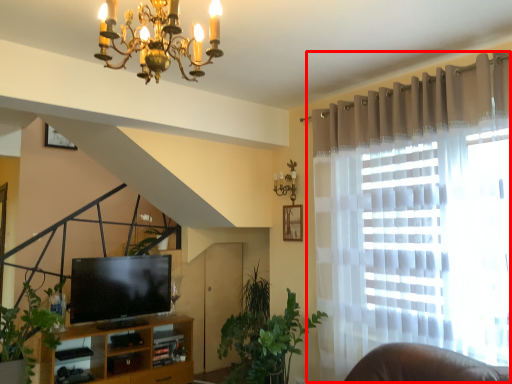
Question: From the image, what is the correct spatial relationship of curtain (annotated by the red box) in relation to plant?

Choices:
 (A) right
 (B) left

Answer: (A)